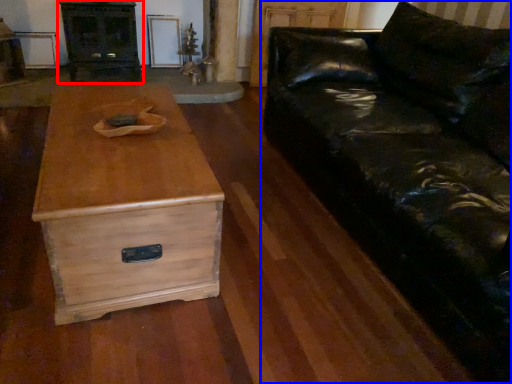
Question: Which object appears closest to the camera in this image, entertainment center (highlighted by a red box) or studio couch (highlighted by a blue box)?

Choices:
 (A) entertainment center
 (B) studio couch

Answer: (B)